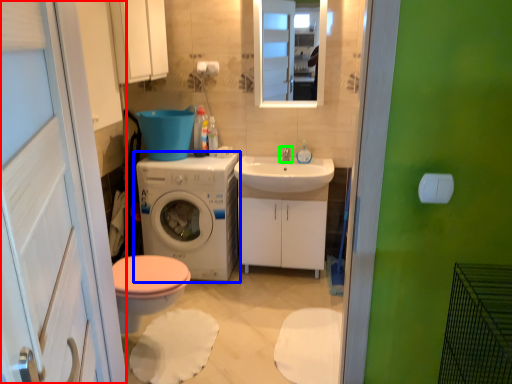
Question: Which object is the farthest from screen door (highlighted by a red box)? Choose among these: washing machine (highlighted by a blue box) or tap (highlighted by a green box).

Choices:
 (A) washing machine
 (B) tap

Answer: (B)